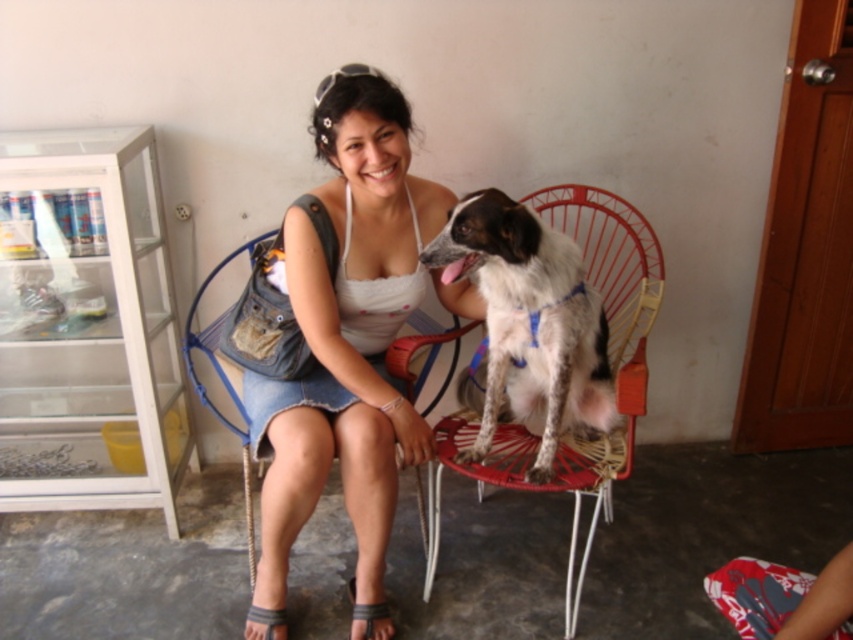
Question: Among these objects, which one is farthest from the camera?

Choices:
 (A) gray fabric sandal at lower center
 (B) white denim skirt at center
 (C) gray fabric sandal at lower left

Answer: (C)

Question: Estimate the real-world distances between objects in this image. Which object is closer to the white denim skirt at center?

Choices:
 (A) gray fabric sandal at lower center
 (B) white speckled fur at center
 (C) gray fabric sandal at lower left
 (D) blue fabric chair at center

Answer: (B)

Question: Is white denim skirt at center smaller than gray fabric sandal at lower left?

Choices:
 (A) yes
 (B) no

Answer: (B)

Question: Which point is farther from the camera taking this photo?

Choices:
 (A) (538, 227)
 (B) (285, 618)
 (C) (380, 310)
 (D) (196, 339)

Answer: (D)

Question: Does blue fabric chair at center appear on the left side of gray fabric sandal at lower left?

Choices:
 (A) yes
 (B) no

Answer: (A)

Question: Is white denim skirt at center to the right of gray fabric sandal at lower center from the viewer's perspective?

Choices:
 (A) no
 (B) yes

Answer: (B)